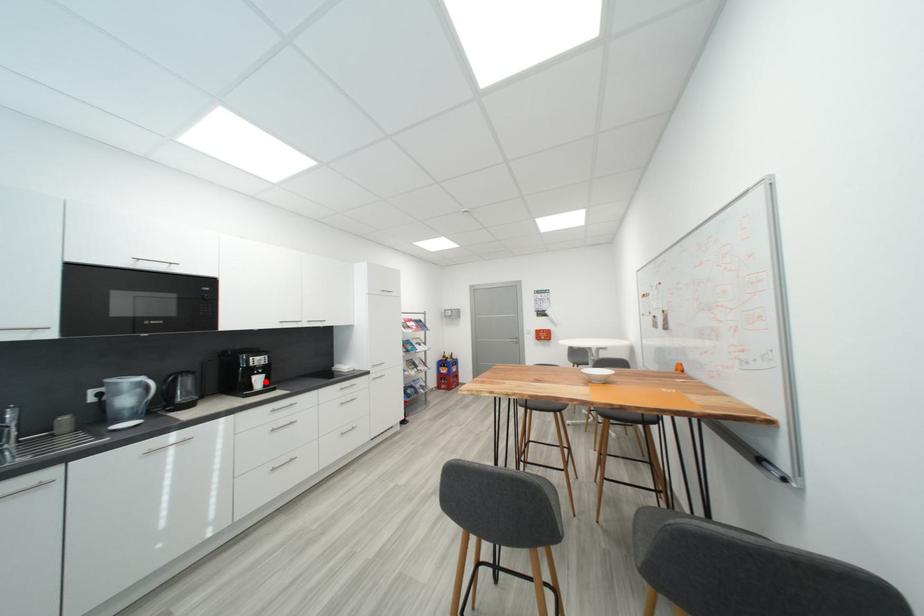
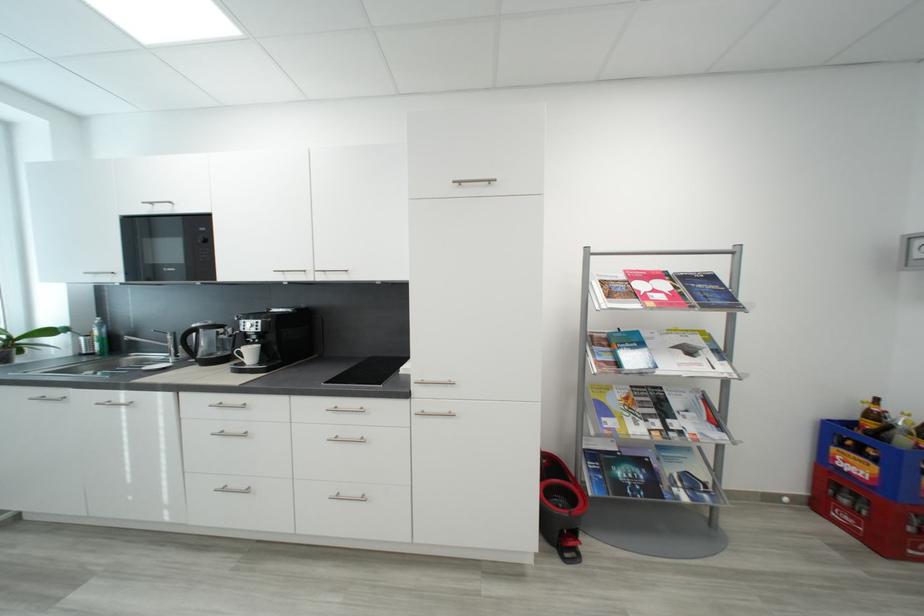
Locate, in the second image, the point that corresponds to the highlighted location in the first image.

(257, 354)